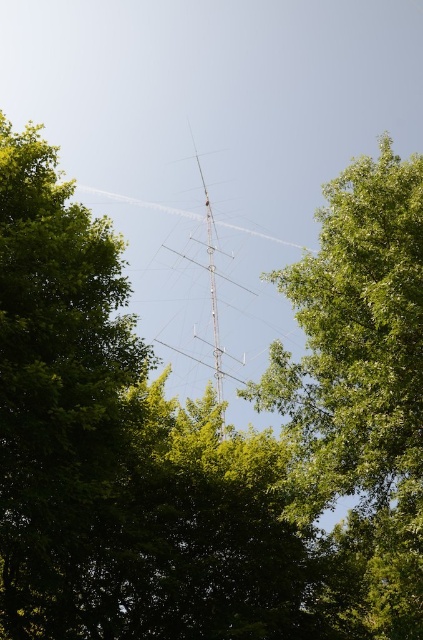
Question: Which point is closer to the camera taking this photo?

Choices:
 (A) (312, 506)
 (B) (214, 232)

Answer: (A)

Question: Which of the following is the closest to the observer?

Choices:
 (A) (373, 317)
 (B) (235, 285)

Answer: (A)

Question: Is green leafy tree at center smaller than silver metallic antenna at center?

Choices:
 (A) no
 (B) yes

Answer: (A)

Question: Can you confirm if green leafy tree at center is positioned to the left of silver metallic antenna at center?

Choices:
 (A) yes
 (B) no

Answer: (B)

Question: Does green leafy tree at center have a smaller size compared to silver metallic antenna at center?

Choices:
 (A) no
 (B) yes

Answer: (A)